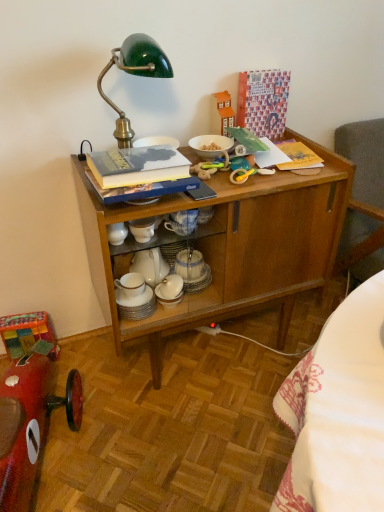
Identify the location of white glossy bowl at upper center, the 1th tableware in the top-to-bottom sequence. This screenshot has width=384, height=512. (211, 146).

Where is `white porcelain cups at center, which is counted as the second tableware, starting from the right`? The width and height of the screenshot is (384, 512). white porcelain cups at center, which is counted as the second tableware, starting from the right is located at coordinates (136, 304).

I want to click on white glossy bowl at upper center, arranged as the second tableware when ordered from the bottom, so click(211, 146).

Is white porcelain cups at center, which is counted as the second tableware, starting from the right, closer to the viewer compared to wooden cabinet at center?

No, white porcelain cups at center, which is counted as the second tableware, starting from the right, is behind wooden cabinet at center.

From a real-world perspective, does white porcelain cups at center, which is the first tableware from left to right, sit lower than wooden cabinet at center?

Yes, from a real-world perspective, white porcelain cups at center, which is the first tableware from left to right, is below wooden cabinet at center.

Between white porcelain cups at center, which is the first tableware from left to right, and wooden cabinet at center, which one has less height?

white porcelain cups at center, which is the first tableware from left to right.

Considering the positions of points (136, 298) and (333, 160), is point (136, 298) farther from camera compared to point (333, 160)?

No, (136, 298) is in front of (333, 160).

Find the location of a particular element. The image size is (384, 512). book on the left of wooden cabinet at center is located at coordinates (137, 166).

From a real-world perspective, is hardcover book at upper center physically located above or below wooden cabinet at center?

In terms of real-world spatial position, hardcover book at upper center is above wooden cabinet at center.

Would you say hardcover book at upper center is outside wooden cabinet at center?

Yes.

How many degrees apart are the facing directions of hardcover book at upper center and wooden cabinet at center?

The facing directions of hardcover book at upper center and wooden cabinet at center are 0.000782 degrees apart.

Which is more to the left, white glossy bowl at upper center, the second tableware in the left-to-right sequence, or white porcelain cups at center, which is counted as the second tableware, starting from the right?

Positioned to the left is white porcelain cups at center, which is counted as the second tableware, starting from the right.

Image resolution: width=384 pixels, height=512 pixels. I want to click on tableware on the right of white porcelain cups at center, which is counted as the 1th tableware, starting from the bottom, so click(211, 146).

In the scene shown: Is white glossy bowl at upper center, the 1th tableware in the top-to-bottom sequence, positioned far away from white porcelain cups at center, which is the first tableware from left to right?

No.

Considering the relative sizes of white glossy bowl at upper center, the second tableware in the left-to-right sequence, and white porcelain cups at center, which ranks as the second tableware in top-to-bottom order, in the image provided, is white glossy bowl at upper center, the second tableware in the left-to-right sequence, thinner than white porcelain cups at center, which ranks as the second tableware in top-to-bottom order,?

In fact, white glossy bowl at upper center, the second tableware in the left-to-right sequence, might be wider than white porcelain cups at center, which ranks as the second tableware in top-to-bottom order.

What's the angular difference between white porcelain cups at center, which is counted as the 1th tableware, starting from the bottom, and hardcover book at upper center's facing directions?

0.00255 degrees separate the facing orientations of white porcelain cups at center, which is counted as the 1th tableware, starting from the bottom, and hardcover book at upper center.

From a real-world perspective, who is located higher, white porcelain cups at center, which is counted as the second tableware, starting from the right, or hardcover book at upper center?

hardcover book at upper center.

Who is shorter, white porcelain cups at center, which is counted as the second tableware, starting from the right, or hardcover book at upper center?

white porcelain cups at center, which is counted as the second tableware, starting from the right.

Who is more distant, hardcover book at upper center or shiny red toy car at lower left?

hardcover book at upper center is more distant.

Is hardcover book at upper center turned away from shiny red toy car at lower left?

No.

Is hardcover book at upper center shorter than shiny red toy car at lower left?

Correct, hardcover book at upper center is not as tall as shiny red toy car at lower left.

Which is more to the right, wooden cabinet at center or white porcelain cups at center, which ranks as the second tableware in top-to-bottom order?

wooden cabinet at center is more to the right.

Considering the sizes of objects wooden cabinet at center and white porcelain cups at center, which is counted as the second tableware, starting from the right, in the image provided, who is bigger, wooden cabinet at center or white porcelain cups at center, which is counted as the second tableware, starting from the right,?

→ wooden cabinet at center.

From the image's perspective, who appears lower, wooden cabinet at center or white porcelain cups at center, which ranks as the second tableware in top-to-bottom order?

From the image's view, white porcelain cups at center, which ranks as the second tableware in top-to-bottom order, is below.

Find the location of a particular element. This screenshot has height=512, width=384. desk on the right of white porcelain cups at center, which is the first tableware from left to right is located at coordinates click(x=230, y=247).

From a real-world perspective, count 1st tablewares downward from the hardcover book at upper center and point to it. Please provide its 2D coordinates.

[(211, 146)]

Is white glossy bowl at upper center, the 1th tableware in the top-to-bottom sequence, wider than hardcover book at upper center?

In fact, white glossy bowl at upper center, the 1th tableware in the top-to-bottom sequence, might be narrower than hardcover book at upper center.

In order to click on desk that appears above the white porcelain cups at center, which is counted as the second tableware, starting from the right (from a real-world perspective) in this screenshot , I will do `click(230, 247)`.

Find the location of a particular element. The width and height of the screenshot is (384, 512). book that appears on the left of wooden cabinet at center is located at coordinates [x=137, y=166].

From the image, which object appears to be farther from white glossy bowl at upper center, the 1th tableware in the top-to-bottom sequence, wooden cabinet at center or shiny red toy car at lower left?

The object further to white glossy bowl at upper center, the 1th tableware in the top-to-bottom sequence, is shiny red toy car at lower left.

Looking at the image, which one is located closer to hardcover book at upper center, wooden cabinet at center or white porcelain cups at center, which is the first tableware from left to right?

Among the two, wooden cabinet at center is located nearer to hardcover book at upper center.

From the image, which object appears to be nearer to hardcover book at upper center, shiny red toy car at lower left or white porcelain cups at center, which is the first tableware from left to right?

white porcelain cups at center, which is the first tableware from left to right, is closer to hardcover book at upper center.

Looking at the image, which one is located closer to hardcover book at upper center, shiny red toy car at lower left or wooden cabinet at center?

wooden cabinet at center lies closer to hardcover book at upper center than the other object.

Estimate the real-world distances between objects in this image. Which object is further from shiny red toy car at lower left, wooden cabinet at center or white glossy bowl at upper center, arranged as the second tableware when ordered from the bottom?

Among the two, white glossy bowl at upper center, arranged as the second tableware when ordered from the bottom, is located further to shiny red toy car at lower left.

Looking at this image, from the image, which object appears to be farther from shiny red toy car at lower left, white porcelain cups at center, which is counted as the 1th tableware, starting from the bottom, or hardcover book at upper center?

hardcover book at upper center is further to shiny red toy car at lower left.

When comparing their distances from wooden cabinet at center, does hardcover book at upper center or white porcelain cups at center, which is the first tableware from left to right, seem closer?

hardcover book at upper center.

Consider the image. Considering their positions, is wooden cabinet at center positioned further to white porcelain cups at center, which ranks as the second tableware in top-to-bottom order, than white glossy bowl at upper center, arranged as the second tableware when ordered from the bottom?

white glossy bowl at upper center, arranged as the second tableware when ordered from the bottom, is further to white porcelain cups at center, which ranks as the second tableware in top-to-bottom order.

Identify the location of book between white glossy bowl at upper center, the 1th tableware in the top-to-bottom sequence, and white porcelain cups at center, which is the first tableware from left to right, in the up-down direction. (137, 166).

In order to click on desk between hardcover book at upper center and shiny red toy car at lower left from top to bottom in this screenshot , I will do `click(230, 247)`.

Image resolution: width=384 pixels, height=512 pixels. In order to click on tableware between shiny red toy car at lower left and wooden cabinet at center in this screenshot , I will do `click(136, 304)`.

At what (x,y) coordinates should I click in order to perform the action: click on tableware between white glossy bowl at upper center, arranged as the second tableware when ordered from the bottom, and shiny red toy car at lower left from top to bottom. Please return your answer as a coordinate pair (x, y). Looking at the image, I should click on (136, 304).